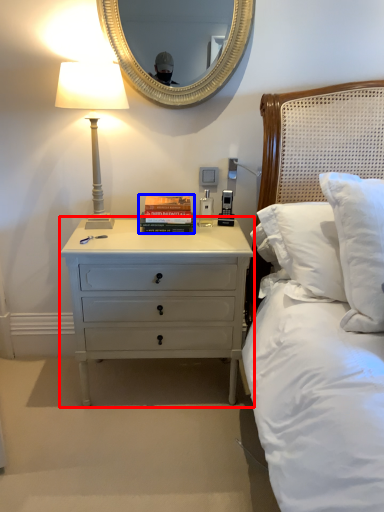
Question: Which object appears closest to the camera in this image, nightstand (highlighted by a red box) or paperback book (highlighted by a blue box)?

Choices:
 (A) nightstand
 (B) paperback book

Answer: (A)